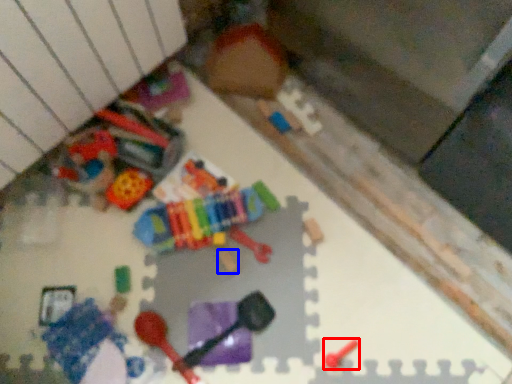
Question: Which of the following is the farthest to the observer, toy (highlighted by a red box) or toy (highlighted by a blue box)?

Choices:
 (A) toy
 (B) toy

Answer: (B)